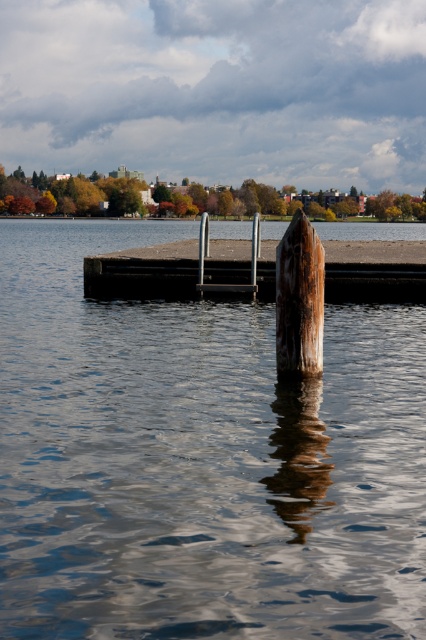
Can you confirm if wooden dock at center is taller than rusty wood post at center?

Yes, wooden dock at center is taller than rusty wood post at center.

How much distance is there between wooden dock at center and rusty wood post at center?

wooden dock at center is 6.18 meters away from rusty wood post at center.

This screenshot has width=426, height=640. Identify the location of wooden dock at center. (374, 269).

Consider the image. Measure the distance between smooth dark water at center and rusty wood post at center.

The distance of smooth dark water at center from rusty wood post at center is 4.07 meters.

Between smooth dark water at center and rusty wood post at center, which one is positioned higher?

smooth dark water at center is higher up.

Between point (8, 336) and point (301, 252), which one is positioned behind?

Point (8, 336)

Identify the location of smooth dark water at center. (199, 460).

Is smooth dark water at center taller than wooden dock at center?

Yes, smooth dark water at center is taller than wooden dock at center.

Is smooth dark water at center to the left of wooden dock at center from the viewer's perspective?

Indeed, smooth dark water at center is positioned on the left side of wooden dock at center.

Image resolution: width=426 pixels, height=640 pixels. Find the location of `smooth dark water at center`. smooth dark water at center is located at coordinates (199, 460).